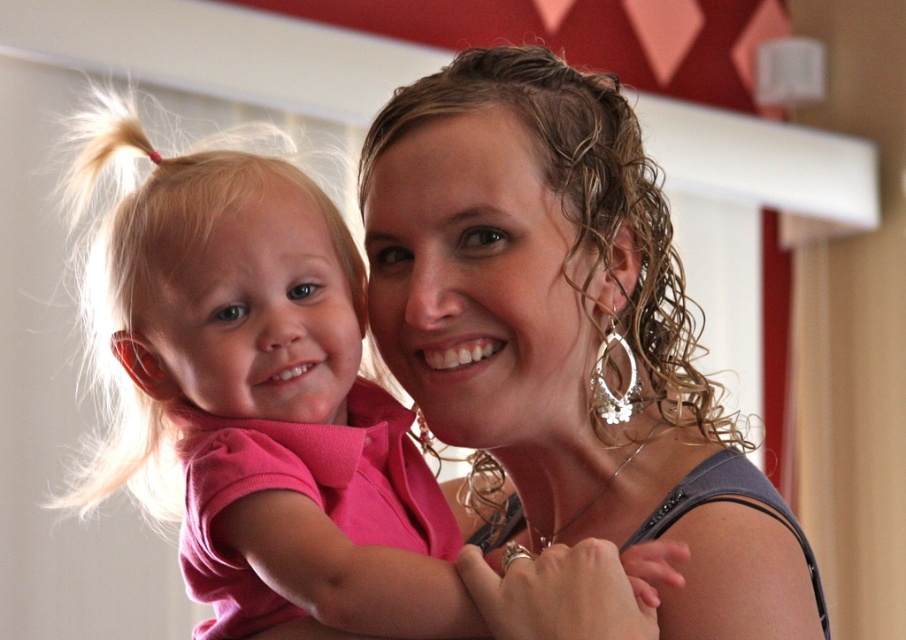
Question: Which object is closer to the camera taking this photo?

Choices:
 (A) matte pink shirt at center
 (B) pink fabric shirt at center

Answer: (B)

Question: Does matte pink shirt at center appear on the left side of pink fabric shirt at center?

Choices:
 (A) yes
 (B) no

Answer: (B)

Question: Which object is closer to the camera taking this photo?

Choices:
 (A) pink fabric shirt at center
 (B) matte pink shirt at center

Answer: (A)

Question: Does matte pink shirt at center have a smaller size compared to pink fabric shirt at center?

Choices:
 (A) yes
 (B) no

Answer: (A)

Question: Does matte pink shirt at center appear on the left side of pink fabric shirt at center?

Choices:
 (A) no
 (B) yes

Answer: (A)